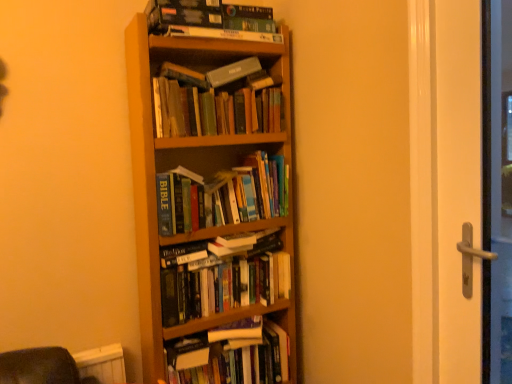
Question: Does point (248, 49) appear closer or farther from the camera than point (179, 11)?

Choices:
 (A) closer
 (B) farther

Answer: (B)

Question: Based on their positions, is wooden bookcase at center located to the left or right of hardcover book at upper center, marked as the first book in a top-to-bottom arrangement?

Choices:
 (A) right
 (B) left

Answer: (A)

Question: Which object is positioned closest to the hardcover books at center, the 2th book when ordered from bottom to top?

Choices:
 (A) wooden bookcase at center
 (B) hardcover gray book at upper center
 (C) hardcover books at center, the 4th book when ordered from bottom to top
 (D) hardcover books at center, which is the 4th book from top to bottom
 (E) hardcover book at center, which appears as the first book when ordered from the bottom

Answer: (D)

Question: Which of these objects is positioned farthest from the hardcover book at upper center, which appears as the 6th book when ordered from the bottom?

Choices:
 (A) hardcover books at upper center, the 5th book ordered from the bottom
 (B) hardcover books at center, the 5th book in the top-to-bottom sequence
 (C) hardcover books at center, the 4th book when ordered from bottom to top
 (D) hardcover book at center, arranged as the sixth book when viewed from the top
 (E) hardcover books at center, the 3th book positioned from the bottom

Answer: (D)